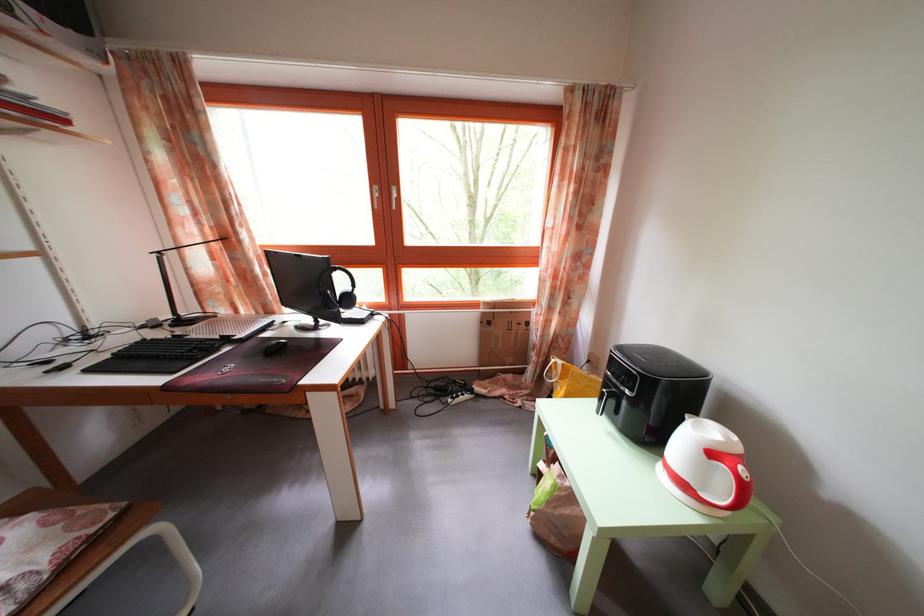
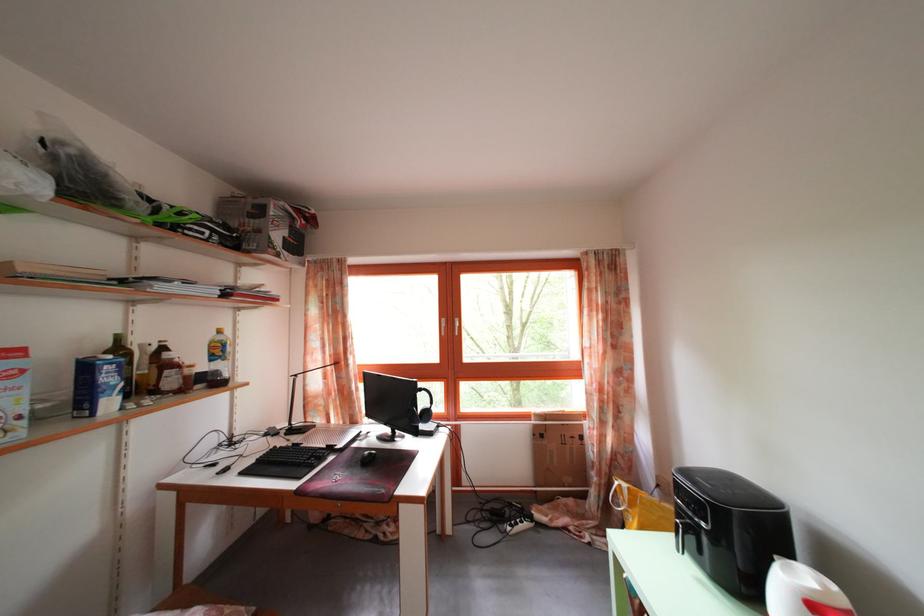
Question: How did the camera likely rotate?

Choices:
 (A) Left
 (B) Right
 (C) Up
 (D) Down

Answer: (C)